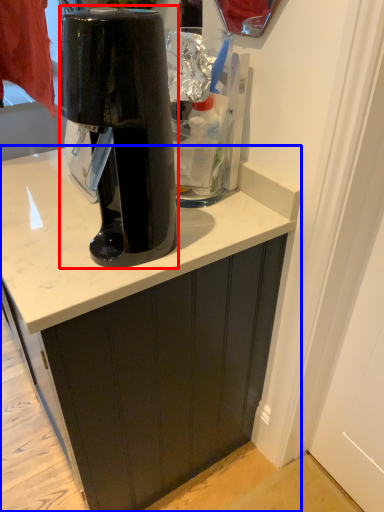
Question: Which object appears closest to the camera in this image, home appliance (highlighted by a red box) or cabinetry (highlighted by a blue box)?

Choices:
 (A) home appliance
 (B) cabinetry

Answer: (A)